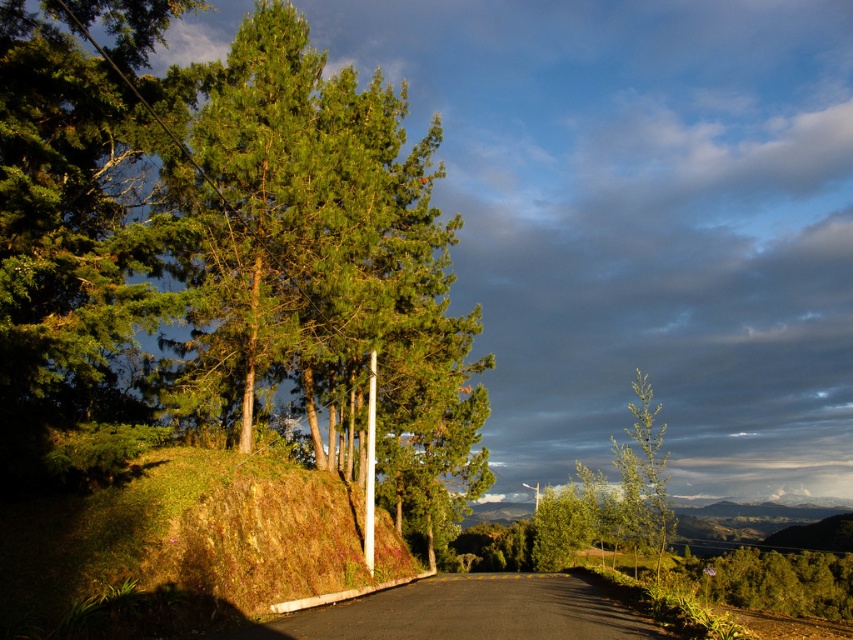
You are standing on the black asphalt road at center and want to climb up to the green mossy hillside at left. Based on the scene description, which direction should you face and walk to reach the hillside?

The green mossy hillside at left is lower than the black asphalt road at center, so you should face the green mossy hillside at left and walk downhill to reach it.

You are driving a car that is 6 feet wide. You need to park your car on the black asphalt road at center. Can you park your car without any part of it extending onto the green mossy hillside at left?

The distance between the green mossy hillside at left and the black asphalt road at center is 12.71 feet. Since your car is only 6 feet wide, you can park it entirely within the road without encroaching on the hillside.

You are a hiker standing at the edge of the road and want to take a photo of both the green glossy tree at upper left and the green leafy tree at right. Which tree should you position yourself closer to in order to have both trees appear in the same frame?

You should position yourself closer to the green glossy tree at upper left because it is in front of the green leafy tree at right, so moving closer to it will help both trees fit within the camera frame.